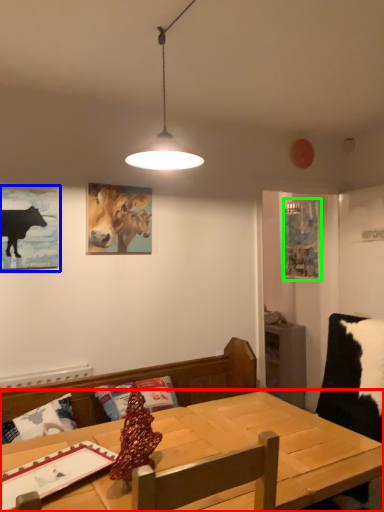
Question: Which is nearer to the table (highlighted by a red box)? picture frame (highlighted by a blue box) or picture frame (highlighted by a green box).

Choices:
 (A) picture frame
 (B) picture frame

Answer: (A)